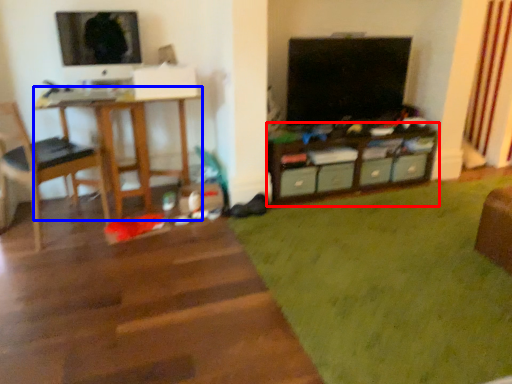
Question: Among these objects, which one is nearest to the camera, shelf (highlighted by a red box) or desk (highlighted by a blue box)?

Choices:
 (A) shelf
 (B) desk

Answer: (B)